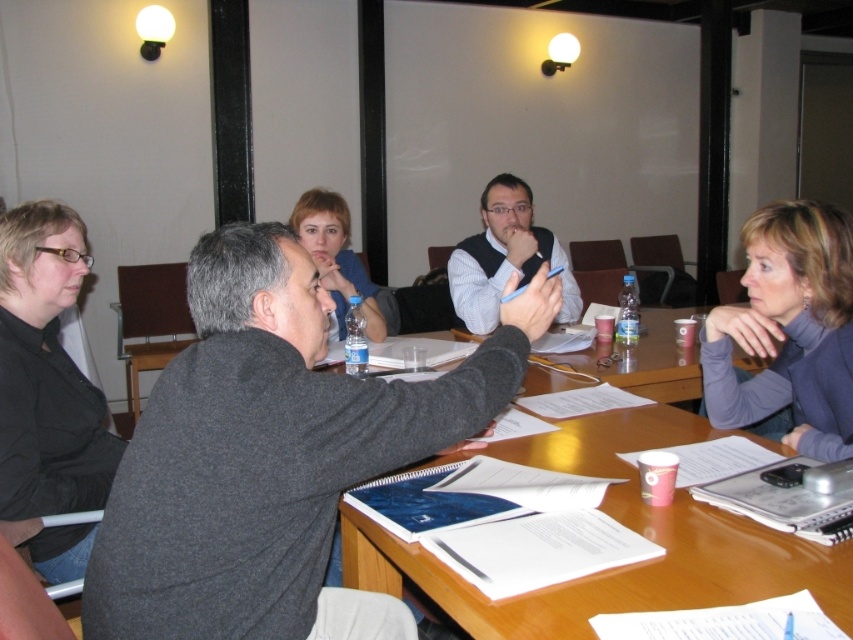
Question: Is wooden table at center thinner than black matte shirt at lower left?

Choices:
 (A) no
 (B) yes

Answer: (A)

Question: Which of these objects is positioned farthest from the wooden table at center?

Choices:
 (A) purple turtleneck sweater at upper right
 (B) black matte shirt at lower left

Answer: (B)

Question: Where is wooden table at center located in relation to purple turtleneck sweater at upper right in the image?

Choices:
 (A) below
 (B) above

Answer: (A)

Question: Is wooden table at center below purple turtleneck sweater at upper right?

Choices:
 (A) no
 (B) yes

Answer: (B)

Question: Which of these objects is positioned closest to the wooden table at center?

Choices:
 (A) black matte shirt at lower left
 (B) matte blue shirt at center

Answer: (A)

Question: Which of the following is the farthest from the observer?

Choices:
 (A) (373, 316)
 (B) (38, 429)
 (C) (811, 276)
 (D) (676, 573)

Answer: (A)